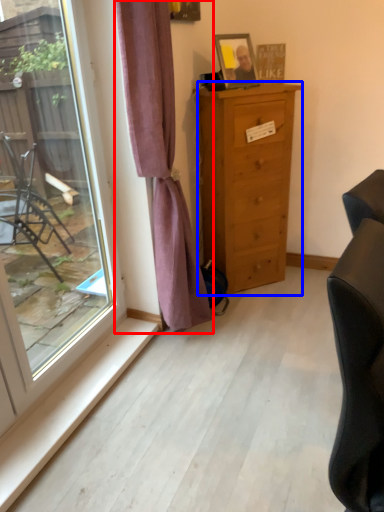
Question: Among these objects, which one is farthest to the camera, curtain (highlighted by a red box) or chest of drawers (highlighted by a blue box)?

Choices:
 (A) curtain
 (B) chest of drawers

Answer: (B)